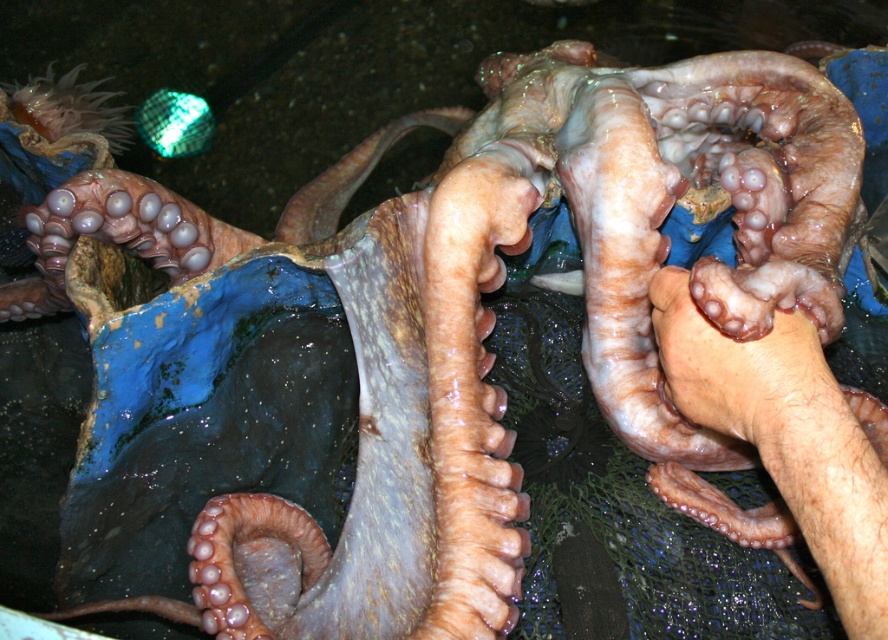
You are a robotic arm trying to pick up the pinkish flesh at center without touching the smooth skin hand at center. Can you safely do so with a 3.5 cm reach?

The distance between the smooth skin hand at center and the pinkish flesh at center is 3.50 centimeters, so the robotic arm can safely pick up the pinkish flesh at center without touching the smooth skin hand at center as the reach matches the distance.

You are a marine biologist examining an octopus in a blue container. You notice the smooth skin hand at center and the pinkish flesh at center. Which object has a wider surface area?

The smooth skin hand at center has a wider surface area than the pinkish flesh at center according to the description provided.

You are a marine biologist observing an octopus in a blue container. You notice the smooth skin hand at center and the pinkish flesh at center. Which object is taller?

The smooth skin hand at center is taller than the pinkish flesh at center.